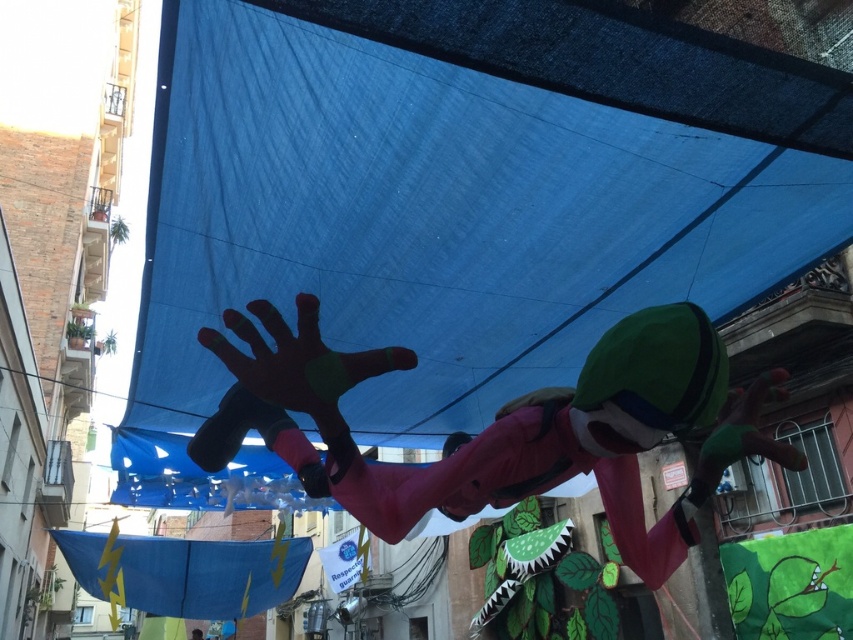
Between blue tarpaulin at center and pink matte fabric at center, which one is positioned lower?

pink matte fabric at center

Which is behind, point (177, 65) or point (608, 458)?

Point (608, 458)

I want to click on blue tarpaulin at center, so click(x=448, y=212).